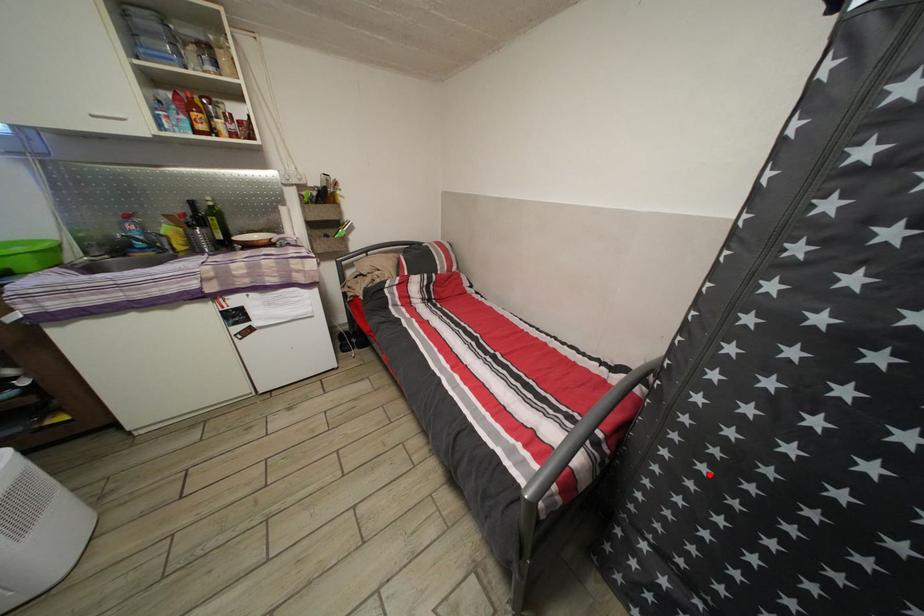
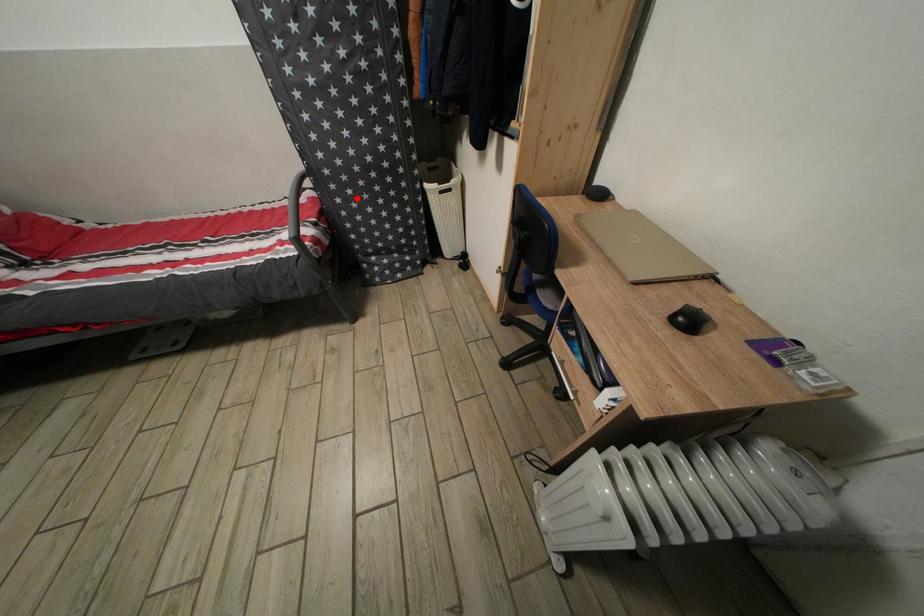
I am providing you with two images of the same scene from different viewpoints. A red point is marked on the first image and another point is marked on the second image. Is the marked point in image1 the same physical position as the marked point in image2?

Yes